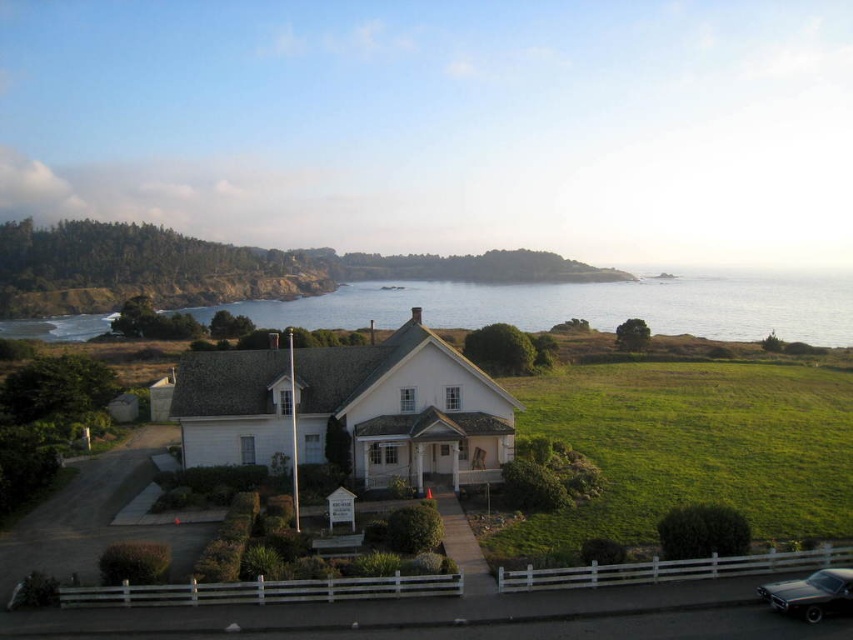
In the scene shown: You are a visitor arriving at the coastal house and notice the shiny black car at lower right and the white wood fence at center. Which object is closer to you as you approach the house?

The white wood fence at center is closer to you because the shiny black car at lower right is behind it.

You are a visitor arriving at the coastal house and see the blue water at center and the shiny black car at lower right. Which object is positioned more towards the east if the sun is setting in the west?

The blue water at center is to the right of the shiny black car at lower right. Since the sun is setting in the west, the right side of the image would correspond to the east direction. Therefore, the blue water at center is positioned more towards the east.

You are a delivery person trying to park your shiny black car at lower right near the white wood fence at center. Can you estimate if there is enough space between them for the car to fit without touching the fence?

The white wood fence at center might be wider than the shiny black car at lower right, so there may be sufficient space for the car to park without touching the fence. However, the exact width difference isn